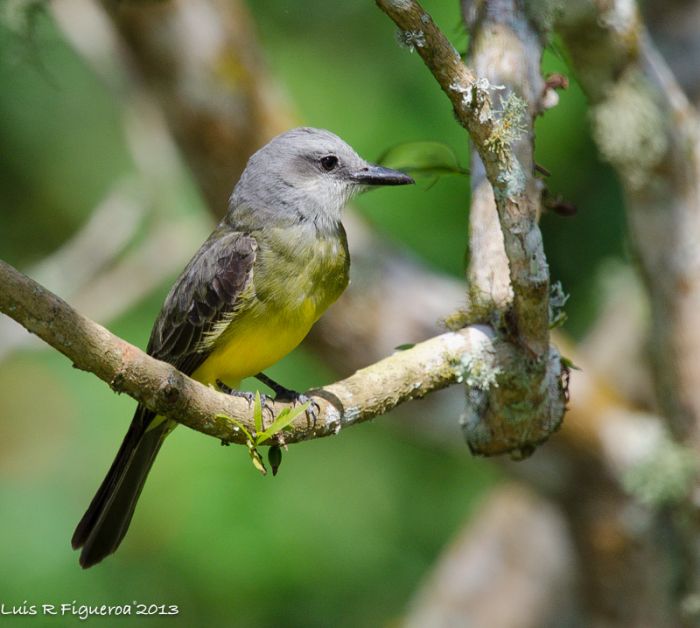
Identify the location of chest. (316, 274).